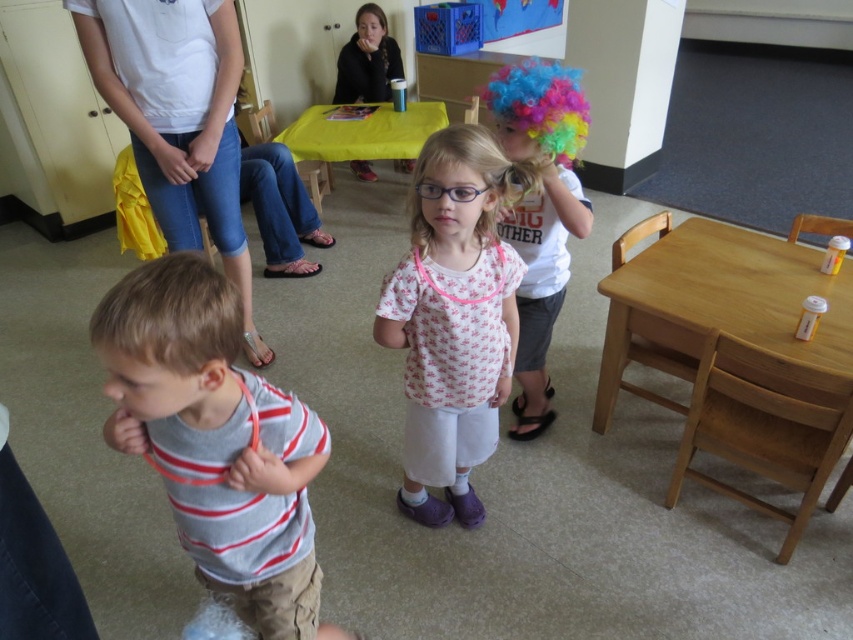
In the scene shown: Does gray striped shirt at center have a lesser height compared to light brown wooden table at right?

Indeed, gray striped shirt at center has a lesser height compared to light brown wooden table at right.

Who is positioned more to the left, gray striped shirt at center or light brown wooden table at right?

gray striped shirt at center

Where is `gray striped shirt at center`? The width and height of the screenshot is (853, 640). gray striped shirt at center is located at coordinates (216, 440).

Find the location of a particular element. The width and height of the screenshot is (853, 640). gray striped shirt at center is located at coordinates (216, 440).

Which is in front, point (521, 120) or point (399, 132)?

Point (521, 120) is in front.

This screenshot has width=853, height=640. What are the coordinates of `multicolored wig at upper center` in the screenshot? It's located at (540, 212).

Where is `multicolored wig at upper center`? This screenshot has height=640, width=853. multicolored wig at upper center is located at coordinates (540, 212).

Can you confirm if light brown wooden table at right is positioned to the right of pink fabric shirt at center?

Correct, you'll find light brown wooden table at right to the right of pink fabric shirt at center.

Measure the distance between point (x=831, y=428) and camera.

Point (x=831, y=428) is 1.84 meters away from camera.

You are a GUI agent. You are given a task and a screenshot of the screen. Output one action in this format:
    pyautogui.click(x=<x>, y=<y>)
    Task: Click on the light brown wooden table at right
    This screenshot has height=640, width=853.
    Given the screenshot: What is the action you would take?
    pyautogui.click(x=737, y=356)